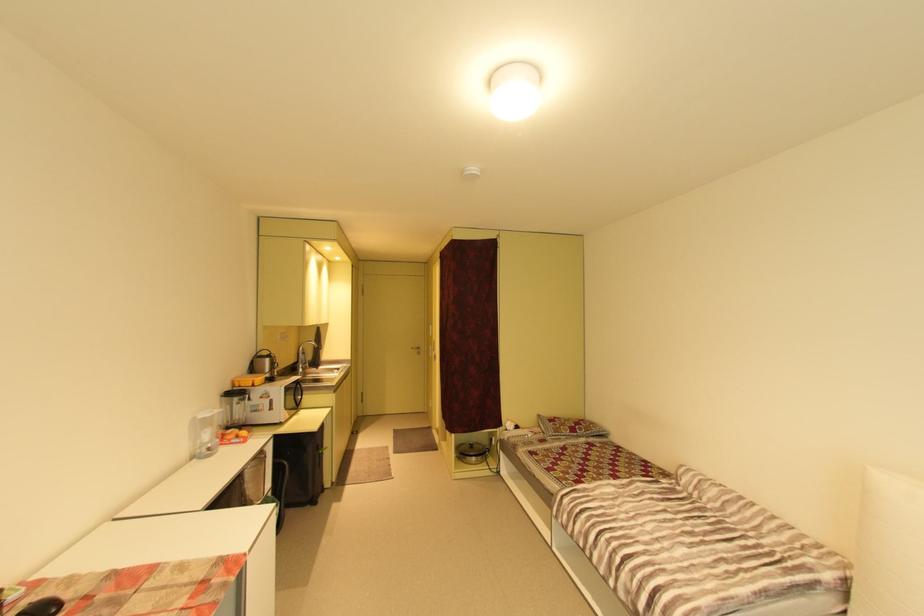
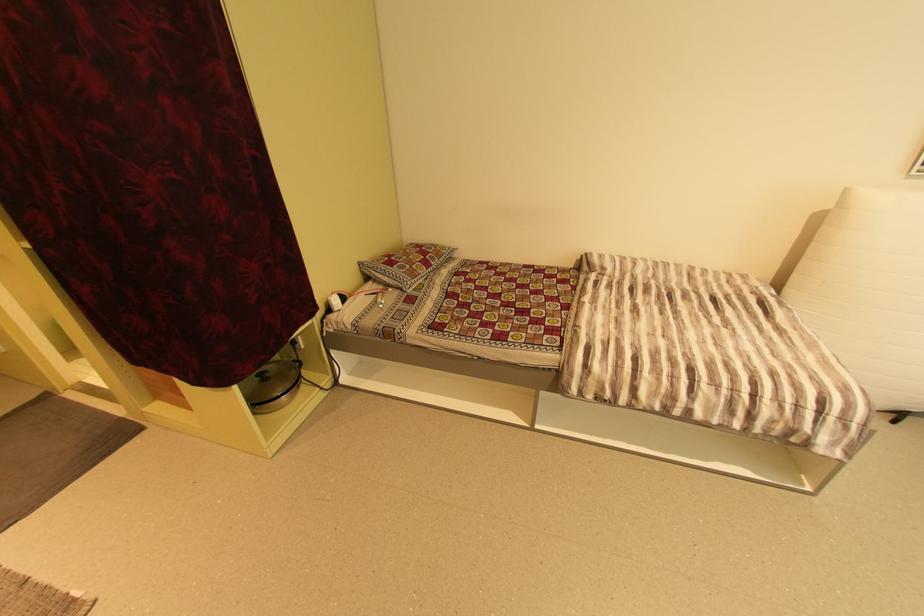
Locate, in the second image, the point that corresponds to (514,430) in the first image.

(335, 310)